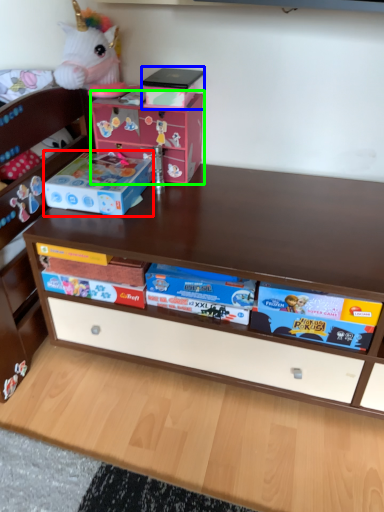
Question: Based on their relative distances, which object is nearer to storage box (highlighted by a red box)? Choose from box (highlighted by a blue box) and cardboard box (highlighted by a green box).

Choices:
 (A) box
 (B) cardboard box

Answer: (B)